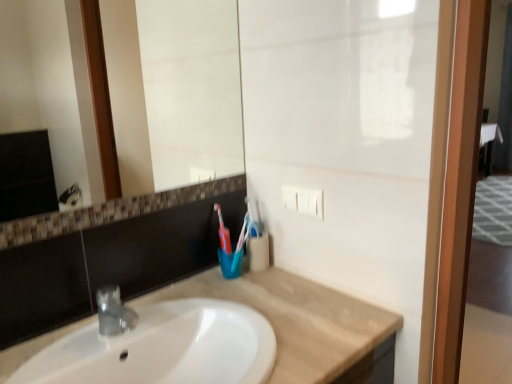
Question: Is beige marble countertop at center not near white glossy mirror at upper center?

Choices:
 (A) no
 (B) yes

Answer: (B)

Question: Is beige marble countertop at center smaller than white glossy mirror at upper center?

Choices:
 (A) no
 (B) yes

Answer: (A)

Question: Can you confirm if beige marble countertop at center is wider than white glossy mirror at upper center?

Choices:
 (A) no
 (B) yes

Answer: (B)

Question: From a real-world perspective, does beige marble countertop at center sit lower than white glossy mirror at upper center?

Choices:
 (A) no
 (B) yes

Answer: (B)

Question: From the image's perspective, does beige marble countertop at center appear lower than white glossy mirror at upper center?

Choices:
 (A) yes
 (B) no

Answer: (A)

Question: Does beige marble countertop at center lie behind white glossy mirror at upper center?

Choices:
 (A) yes
 (B) no

Answer: (B)

Question: Is white glossy mirror at upper center bigger than beige marble countertop at center?

Choices:
 (A) yes
 (B) no

Answer: (B)

Question: Can you confirm if white glossy mirror at upper center is wider than beige marble countertop at center?

Choices:
 (A) no
 (B) yes

Answer: (A)

Question: Is white glossy mirror at upper center closer to the viewer compared to beige marble countertop at center?

Choices:
 (A) yes
 (B) no

Answer: (B)

Question: Is white glossy mirror at upper center further to the viewer compared to beige marble countertop at center?

Choices:
 (A) no
 (B) yes

Answer: (B)

Question: Could you tell me if white glossy mirror at upper center is turned towards beige marble countertop at center?

Choices:
 (A) no
 (B) yes

Answer: (A)

Question: Would you consider white glossy mirror at upper center to be distant from beige marble countertop at center?

Choices:
 (A) yes
 (B) no

Answer: (A)

Question: Considering the relative sizes of beige marble countertop at center and blue plastic toothbrush at center in the image provided, is beige marble countertop at center taller than blue plastic toothbrush at center?

Choices:
 (A) no
 (B) yes

Answer: (A)